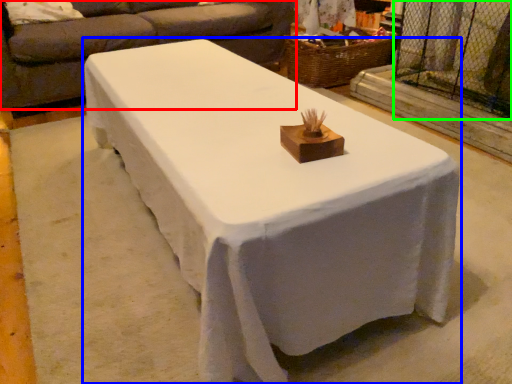
Question: Which object is positioned closest to studio couch (highlighted by a red box)? Select from table (highlighted by a blue box) and screen door (highlighted by a green box).

Choices:
 (A) table
 (B) screen door

Answer: (B)